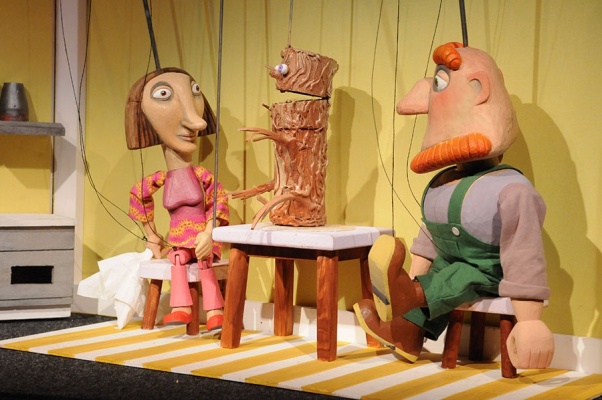
Find the location of a particular element. table leg is located at coordinates (278, 286), (233, 297), (324, 318), (370, 289).